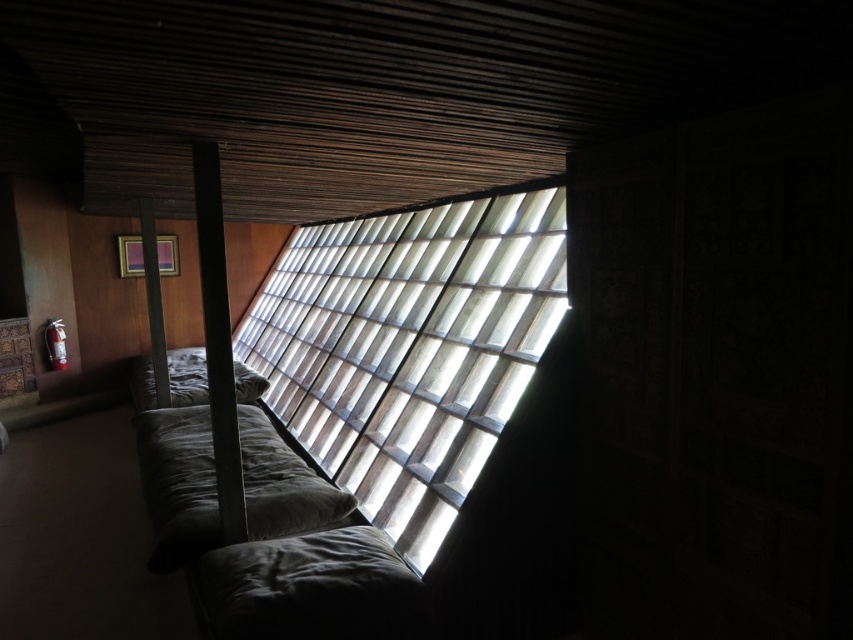
Is point (218, 179) farther from viewer compared to point (146, 205)?

That is False.

Between point (242, 529) and point (166, 381), which one is positioned behind?

The point (166, 381) is more distant.

Image resolution: width=853 pixels, height=640 pixels. I want to click on black matte beam at center, so click(218, 340).

Looking at this image, does velvet green bed at center have a larger size compared to black matte beam at center?

Indeed, velvet green bed at center has a larger size compared to black matte beam at center.

Can you confirm if velvet green bed at center is positioned to the left of black matte beam at center?

Yes, velvet green bed at center is to the left of black matte beam at center.

Between point (369, 540) and point (228, 468), which one is positioned behind?

Point (369, 540)

The width and height of the screenshot is (853, 640). Find the location of `velvet green bed at center`. velvet green bed at center is located at coordinates (x=262, y=524).

Who is more distant from viewer, (x=178, y=483) or (x=154, y=352)?

The point (x=154, y=352) is more distant.

In the scene shown: Which is below, velvet green bed at center or matte gray beam at center?

Positioned lower is velvet green bed at center.

Does point (413, 636) come behind point (164, 349)?

No, (413, 636) is closer to viewer.

Locate an element on the screen. velvet green bed at center is located at coordinates (262, 524).